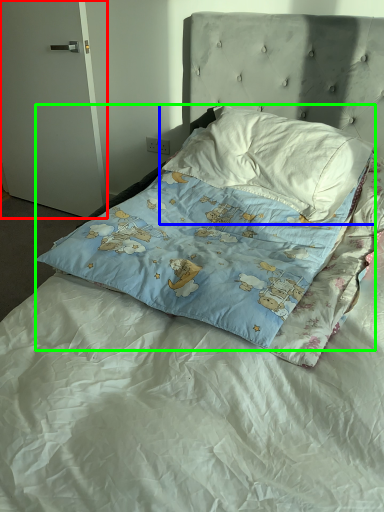
Question: Estimate the real-world distances between objects in this image. Which object is farther from door (highlighted by a red box), pillow (highlighted by a blue box) or pillow (highlighted by a green box)?

Choices:
 (A) pillow
 (B) pillow

Answer: (B)